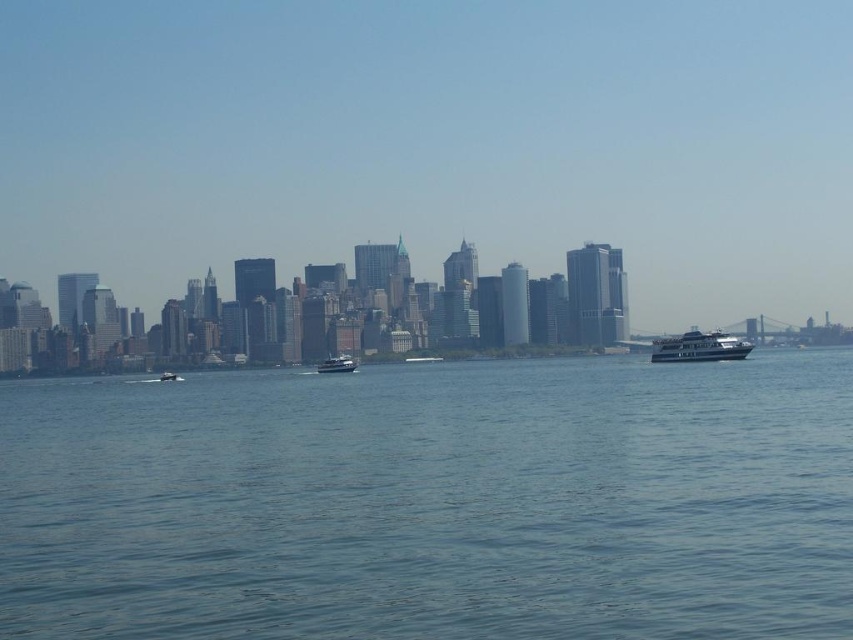
You are a photographer standing at the waterfront and want to capture the white glossy ferry at right in your shot. The camera you are using has a maximum zoom range of 1000 feet. Can you capture the ferry without moving closer?

The white glossy ferry at right is 1691.03 feet from camera. Since the camera can only zoom up to 1000 feet, you cannot capture the ferry clearly without moving closer.

You are standing at the point with coordinates (433, 502) in the city skyline image. What do you see directly in front of you?

You see blue water at center directly in front of you at point (433, 502).